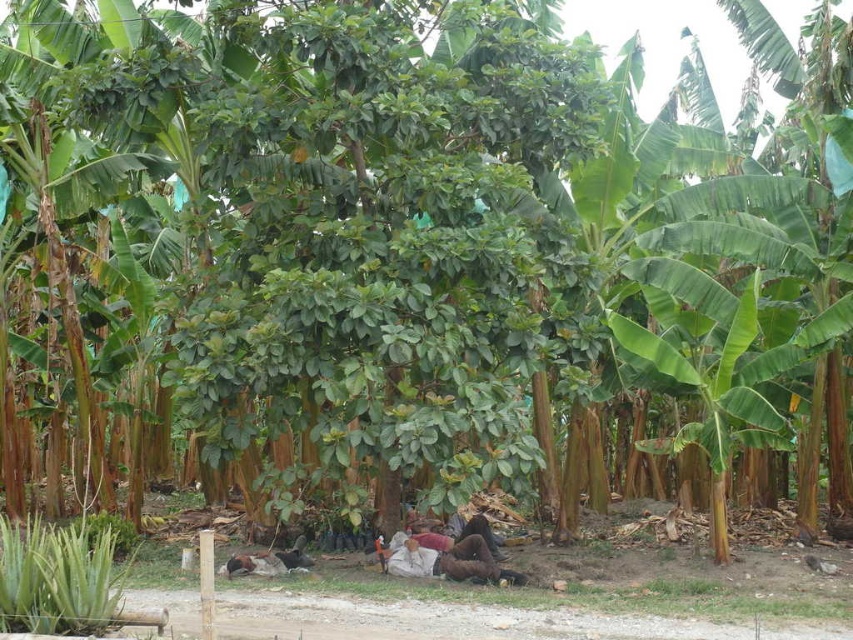
Question: Is green leafy plant at lower left below brown fabric person at center?

Choices:
 (A) no
 (B) yes

Answer: (A)

Question: Which point is farther to the camera?

Choices:
 (A) green leafy plant at lower left
 (B) brown fabric person at center

Answer: (B)

Question: Where is green leafy plant at lower left located in relation to brown fabric person at center in the image?

Choices:
 (A) above
 (B) below

Answer: (A)

Question: Does green leafy plant at lower left have a lesser width compared to brown fabric person at center?

Choices:
 (A) yes
 (B) no

Answer: (A)

Question: Which of the following is the closest to the observer?

Choices:
 (A) (473, 573)
 (B) (82, 568)

Answer: (B)

Question: Which point is closer to the camera taking this photo?

Choices:
 (A) (462, 545)
 (B) (33, 582)

Answer: (B)